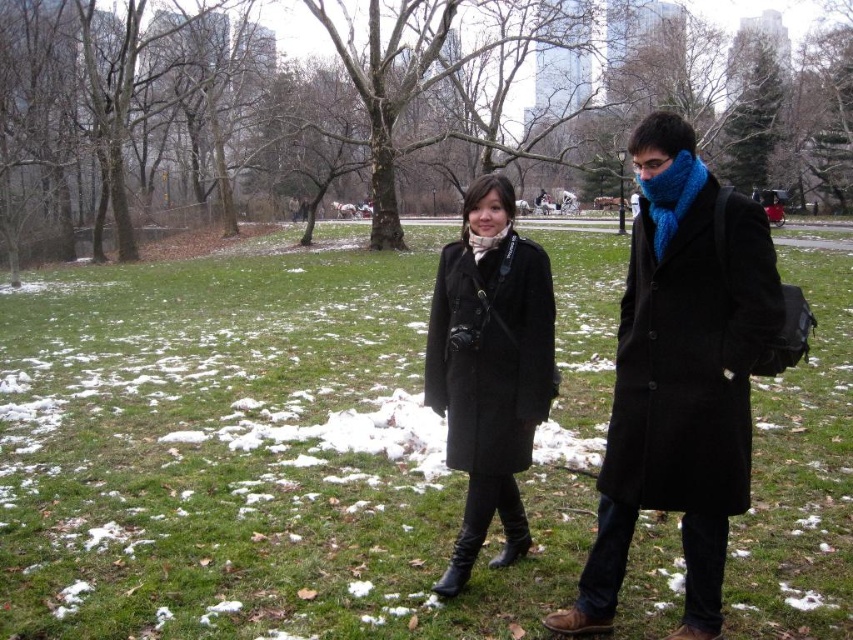
Which is more to the left, blue knitted scarf at right or blue knitted scarf at center?

Positioned to the left is blue knitted scarf at center.

The height and width of the screenshot is (640, 853). What do you see at coordinates (671, 195) in the screenshot?
I see `blue knitted scarf at right` at bounding box center [671, 195].

Between point (657, 184) and point (480, 252), which one is positioned in front?

Positioned in front is point (657, 184).

Locate an element on the screen. This screenshot has height=640, width=853. blue knitted scarf at right is located at coordinates (671, 195).

From the picture: Which of these two, green grass at center or blue knitted scarf at right, stands shorter?

blue knitted scarf at right is shorter.

This screenshot has width=853, height=640. Identify the location of green grass at center. (271, 449).

Can you confirm if black wool coat at right is thinner than black wool coat at center?

Incorrect, black wool coat at right's width is not less than black wool coat at center's.

Does point (722, 355) lie behind point (460, 355)?

That is False.

Locate an element on the screen. This screenshot has height=640, width=853. black wool coat at right is located at coordinates (691, 356).